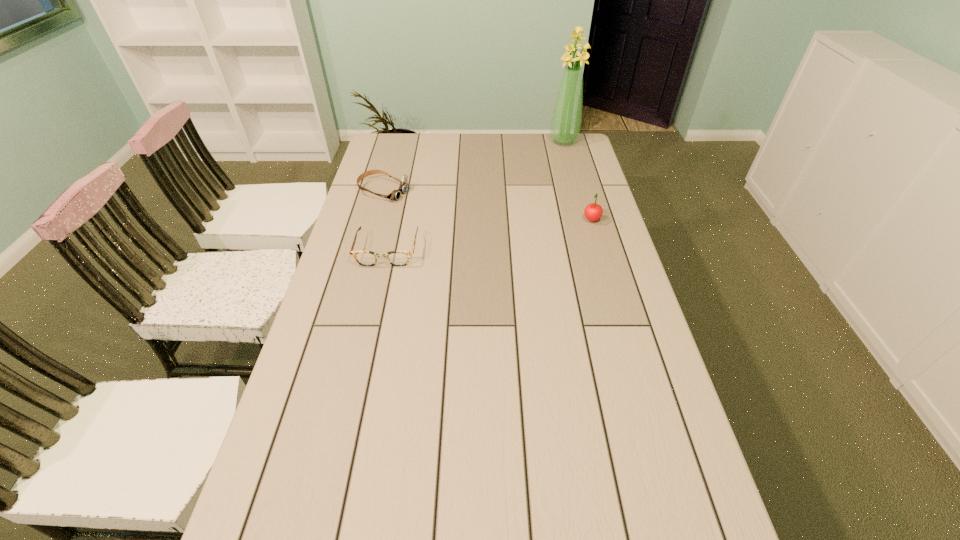
Identify the location of free space between the second tallest object and the spectacles. (490, 235).

The image size is (960, 540). I want to click on vacant space in between the second tallest object and the farthest object, so click(x=578, y=181).

This screenshot has width=960, height=540. I want to click on free spot between the goggles and the nearest object, so click(x=386, y=221).

You are a GUI agent. You are given a task and a screenshot of the screen. Output one action in this format:
    pyautogui.click(x=<x>, y=<y>)
    Task: Click on the vacant area that lies between the spectacles and the second farthest object
    Image resolution: width=960 pixels, height=540 pixels.
    Given the screenshot: What is the action you would take?
    pyautogui.click(x=386, y=221)

Locate an element on the screen. free space between the nearest object and the second farthest object is located at coordinates (386, 221).

Point out which object is positioned as the second nearest to the nearest object. Please provide its 2D coordinates. Your answer should be formatted as a tuple, i.e. [(x, y)], where the tuple contains the x and y coordinates of a point satisfying the conditions above.

[(593, 212)]

The height and width of the screenshot is (540, 960). Find the location of `object that is the third closest to the goggles`. object that is the third closest to the goggles is located at coordinates 593,212.

This screenshot has height=540, width=960. I want to click on vacant region that satisfies the following two spatial constraints: 1. on the back side of the bouquet; 2. on the right side of the second farthest object, so click(x=397, y=141).